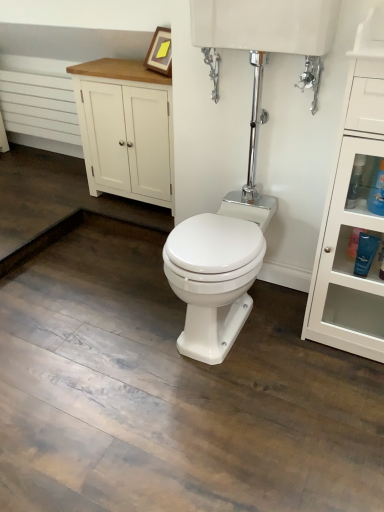
Question: In terms of size, does white painted wood cabinet at upper left appear bigger or smaller than blue glossy bottle at right?

Choices:
 (A) small
 (B) big

Answer: (B)

Question: Considering the positions of white painted wood cabinet at upper left and blue glossy bottle at right in the image, is white painted wood cabinet at upper left wider or thinner than blue glossy bottle at right?

Choices:
 (A) wide
 (B) thin

Answer: (A)

Question: Estimate the real-world distances between objects in this image. Which object is farther from the white glossy cabinet at right?

Choices:
 (A) white glossy tank at upper center
 (B) white painted wood cabinet at upper left
 (C) blue glossy bottle at right

Answer: (B)

Question: Which is nearer to the white painted wood cabinet at upper left?

Choices:
 (A) blue glossy bottle at right
 (B) white glossy cabinet at right
 (C) white glossy tank at upper center

Answer: (C)